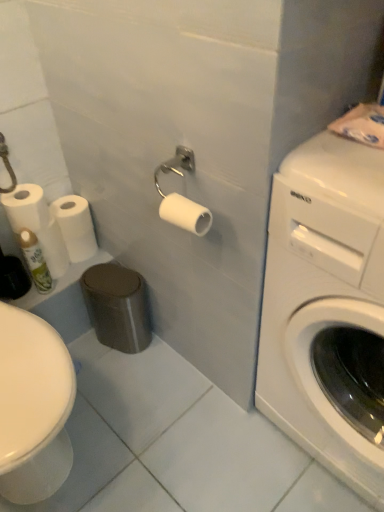
Question: From a real-world perspective, relative to white matte toilet paper at left, placed as the second toilet paper when sorted from left to right, is white glossy washing machine at right vertically above or below?

Choices:
 (A) above
 (B) below

Answer: (A)

Question: Does point (372, 253) appear closer or farther from the camera than point (84, 202)?

Choices:
 (A) farther
 (B) closer

Answer: (B)

Question: Estimate the real-world distances between objects in this image. Which object is closer to the white matte toilet paper at left, placed as the second toilet paper when sorted from left to right?

Choices:
 (A) white glossy washing machine at right
 (B) green matte spray can at lower left
 (C) white matte toilet paper at left, acting as the 3th toilet paper starting from the right
 (D) white matte toilet paper at center, the 3th toilet paper when ordered from back to front

Answer: (C)

Question: Considering the real-world distances, which object is closest to the green matte spray can at lower left?

Choices:
 (A) white matte toilet paper at center, which is the 1th toilet paper in front-to-back order
 (B) white glossy washing machine at right
 (C) white matte toilet paper at left, arranged as the 3th toilet paper when viewed from the front
 (D) white matte toilet paper at left, which is counted as the 2th toilet paper, starting from the back

Answer: (D)